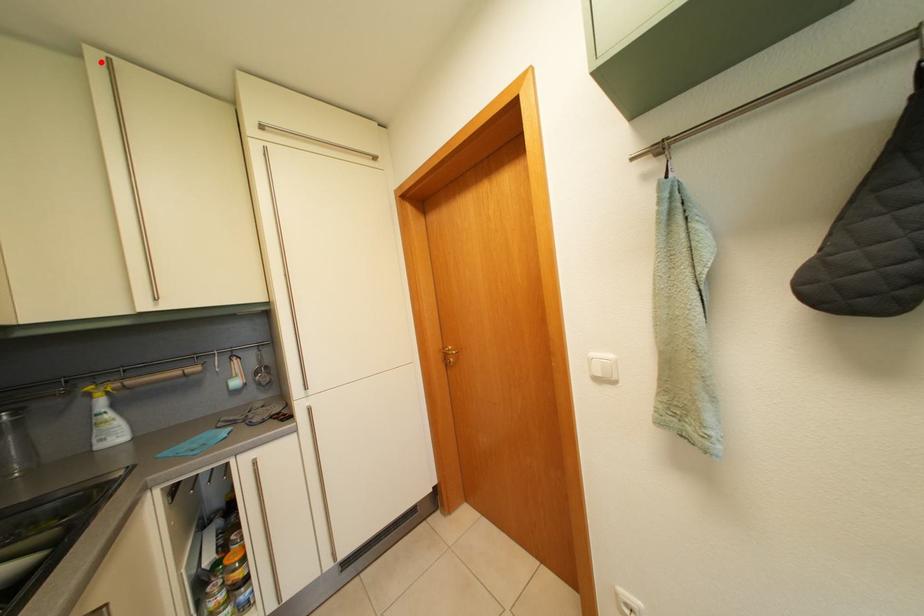
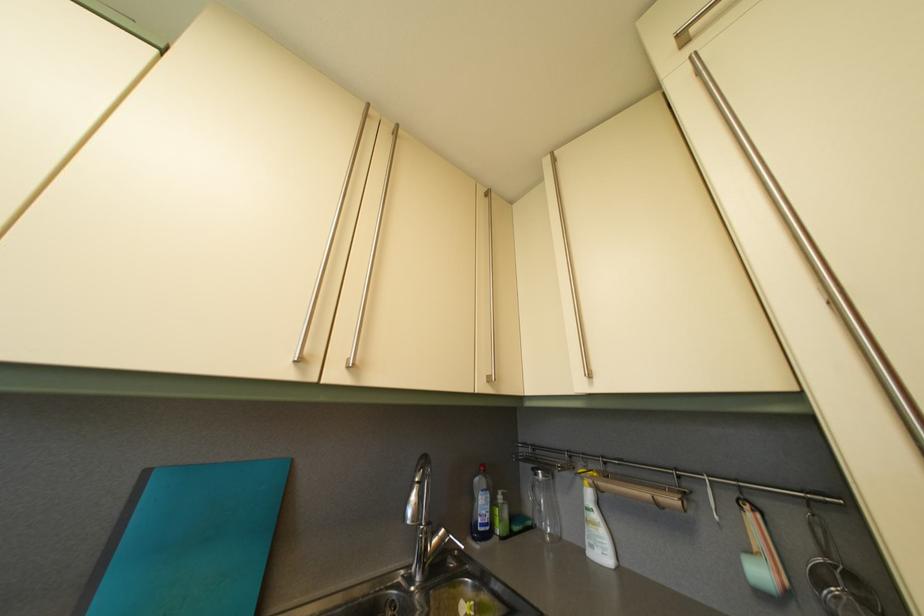
Find the pixel in the second image that matches the highlighted location in the first image.

(554, 169)